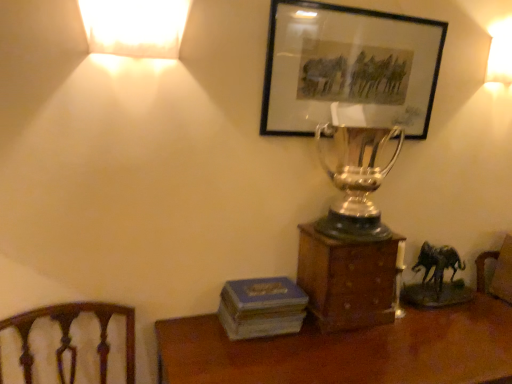
Image resolution: width=512 pixels, height=384 pixels. Find the location of `free spot above blue matte book at lower center (from a real-world perspective)`. free spot above blue matte book at lower center (from a real-world perspective) is located at coordinates (257, 290).